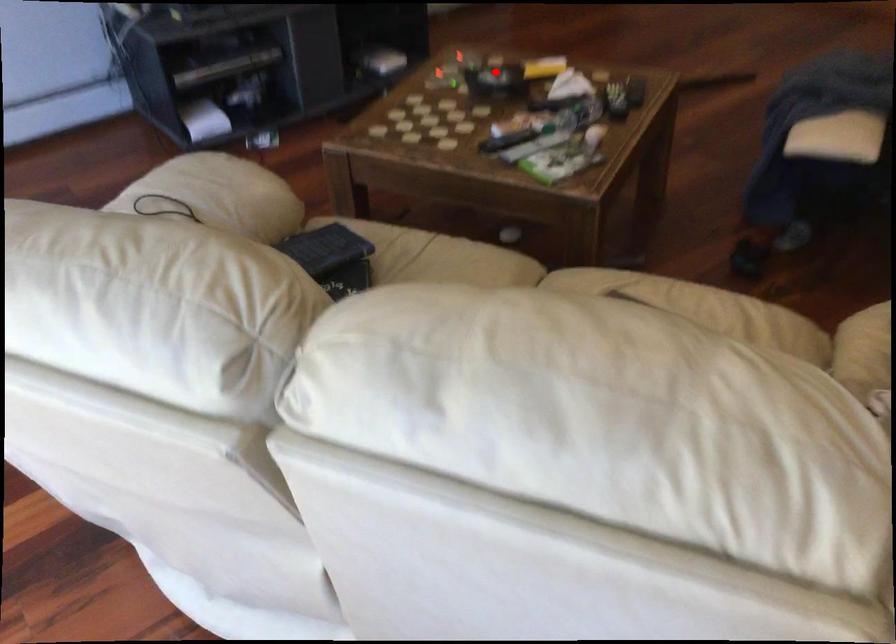
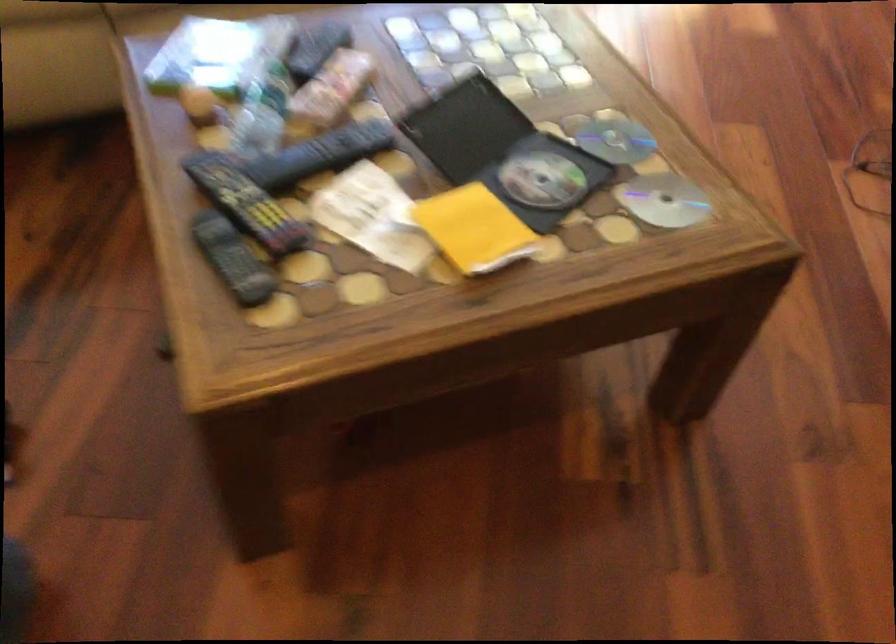
Find the pixel in the second image that matches the highlighted location in the first image.

(541, 180)